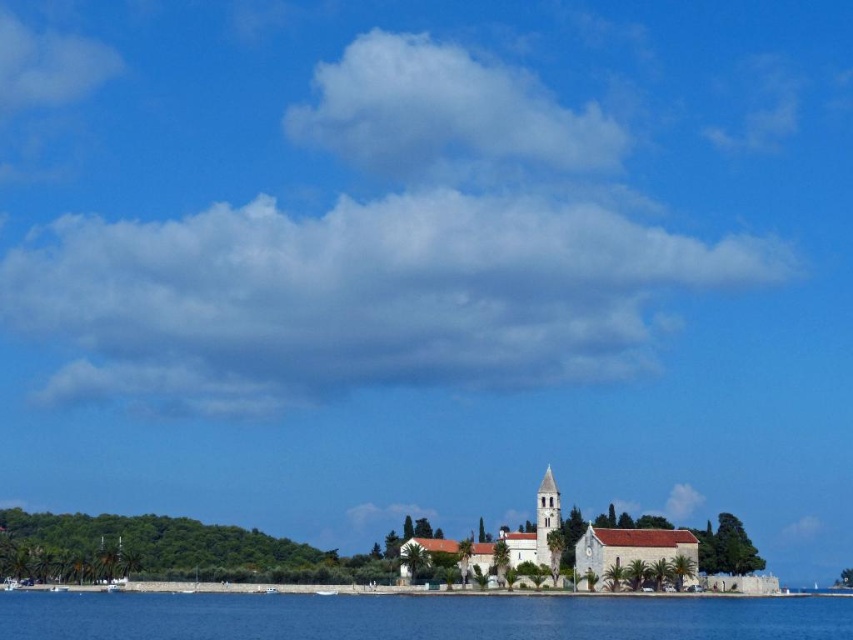
Question: Which point is farther from the camera taking this photo?

Choices:
 (A) (776, 602)
 (B) (601, 545)

Answer: (A)

Question: Which point is farther from the camera taking this photo?

Choices:
 (A) (558, 512)
 (B) (538, 536)
 (C) (670, 612)

Answer: (A)

Question: Can you confirm if blue water at lower center is positioned to the right of white stone spire at center?

Choices:
 (A) yes
 (B) no

Answer: (B)

Question: Which is farther from the blue water at lower center?

Choices:
 (A) white stone church at center
 (B) white stone spire at center

Answer: (B)

Question: Observing the image, what is the correct spatial positioning of white stone church at center in reference to white stone spire at center?

Choices:
 (A) right
 (B) left

Answer: (A)

Question: In this image, where is white stone church at center located relative to white stone spire at center?

Choices:
 (A) above
 (B) below

Answer: (B)